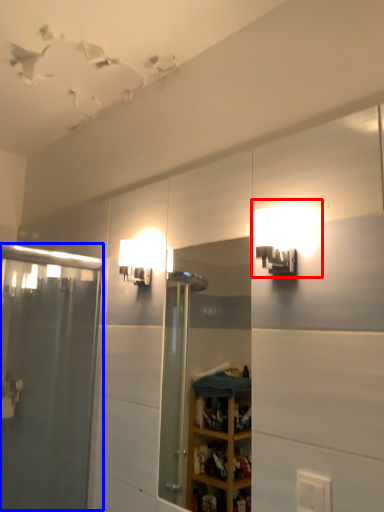
Question: Which object is further to the camera taking this photo, light fixture (highlighted by a red box) or screen door (highlighted by a blue box)?

Choices:
 (A) light fixture
 (B) screen door

Answer: (B)